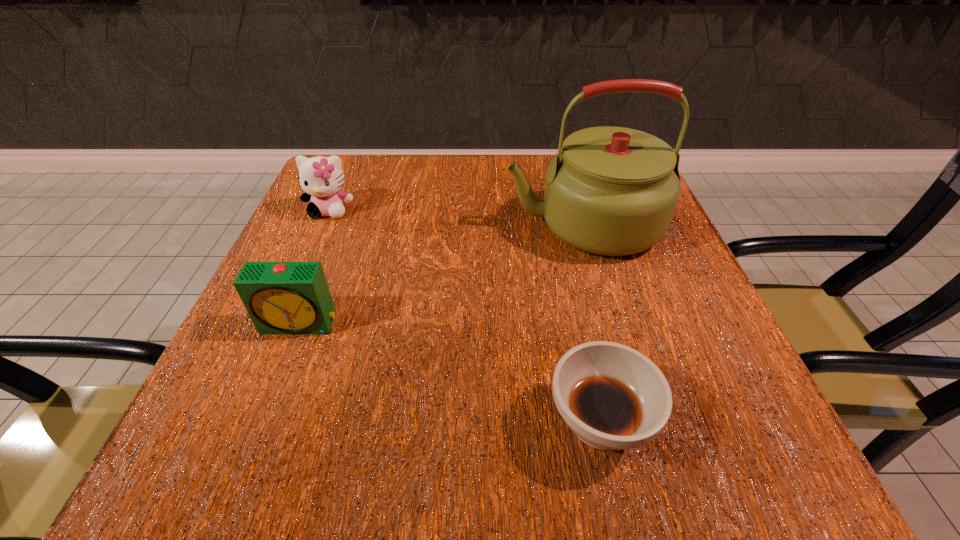
Locate an element on the screen. The height and width of the screenshot is (540, 960). object that is at the near right corner is located at coordinates (x=613, y=397).

The width and height of the screenshot is (960, 540). In order to click on free space at the far edge in this screenshot , I will do `click(529, 169)`.

Image resolution: width=960 pixels, height=540 pixels. I want to click on vacant space at the near edge of the desktop, so click(512, 440).

In order to click on blank space at the left edge of the desktop in this screenshot , I will do `click(239, 372)`.

In the image, there is a desktop. Identify the location of vacant space at the right edge. This screenshot has height=540, width=960. (676, 342).

Locate an element on the screen. The image size is (960, 540). vacant region between the kettle and the kitten is located at coordinates (457, 217).

This screenshot has width=960, height=540. Identify the location of free space between the nearest object and the kettle. (591, 323).

Where is `vacant region between the tallest object and the kitten`? vacant region between the tallest object and the kitten is located at coordinates (457, 217).

Locate an element on the screen. empty location between the kitten and the nearest object is located at coordinates (465, 316).

At what (x,y) coordinates should I click in order to perform the action: click on blank region between the alarm clock and the nearest object. Please return your answer as a coordinate pair (x, y). This screenshot has height=540, width=960. Looking at the image, I should click on (450, 373).